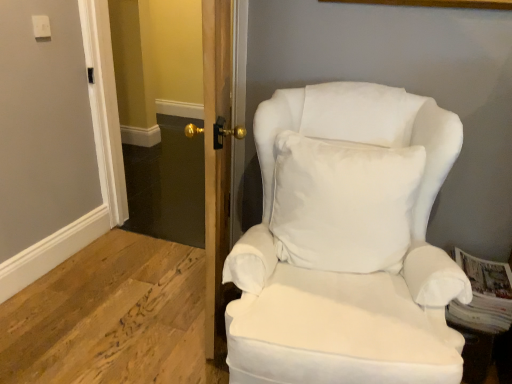
This screenshot has height=384, width=512. Find the location of `vacant region to the left of white fabric chair at right`. vacant region to the left of white fabric chair at right is located at coordinates (128, 313).